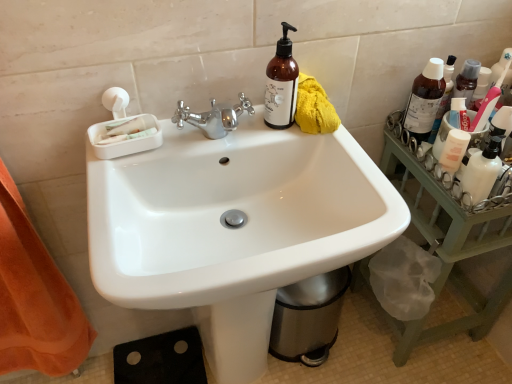
Question: From a real-world perspective, is white glossy mouthwash at right on top of translucent plastic bottle at upper right, acting as the 1th bottle starting from the right?

Choices:
 (A) no
 (B) yes

Answer: (A)

Question: Can we say white glossy mouthwash at right lies outside translucent plastic bottle at upper right, which is the 3th bottle from left to right?

Choices:
 (A) no
 (B) yes

Answer: (B)

Question: Is white glossy mouthwash at right positioned in front of translucent plastic bottle at upper right, which is the 3th bottle from left to right?

Choices:
 (A) yes
 (B) no

Answer: (A)

Question: Considering the relative sizes of white glossy mouthwash at right and translucent plastic bottle at upper right, which is the 3th bottle from left to right, in the image provided, is white glossy mouthwash at right wider than translucent plastic bottle at upper right, which is the 3th bottle from left to right,?

Choices:
 (A) yes
 (B) no

Answer: (A)

Question: Is white glossy mouthwash at right beside translucent plastic bottle at upper right, which is the 3th bottle from left to right?

Choices:
 (A) no
 (B) yes

Answer: (A)

Question: Choose the correct answer: Is white glossy lotion at right inside green wood tray at right or outside it?

Choices:
 (A) outside
 (B) inside

Answer: (A)

Question: Is point (476, 175) closer or farther from the camera than point (389, 130)?

Choices:
 (A) closer
 (B) farther

Answer: (A)

Question: From the image's perspective, relative to green wood tray at right, is white glossy lotion at right above or below?

Choices:
 (A) above
 (B) below

Answer: (A)

Question: Considering the positions of white glossy lotion at right and green wood tray at right in the image, is white glossy lotion at right wider or thinner than green wood tray at right?

Choices:
 (A) thin
 (B) wide

Answer: (A)

Question: Considering the positions of white glossy mouthwash at right and white glossy lotion at right in the image, is white glossy mouthwash at right bigger or smaller than white glossy lotion at right?

Choices:
 (A) big
 (B) small

Answer: (B)

Question: Considering their positions, is white glossy mouthwash at right located in front of or behind white glossy lotion at right?

Choices:
 (A) front
 (B) behind

Answer: (B)

Question: Is white glossy mouthwash at right wider or thinner than white glossy lotion at right?

Choices:
 (A) thin
 (B) wide

Answer: (B)

Question: Would you say white glossy mouthwash at right is to the left or to the right of white glossy lotion at right in the picture?

Choices:
 (A) left
 (B) right

Answer: (A)

Question: Is white glossy mouthwash at right taller or shorter than translucent plastic bottle at upper right, acting as the 1th bottle starting from the right?

Choices:
 (A) short
 (B) tall

Answer: (A)

Question: Considering the positions of point (452, 162) and point (444, 64), is point (452, 162) closer or farther from the camera than point (444, 64)?

Choices:
 (A) closer
 (B) farther

Answer: (A)